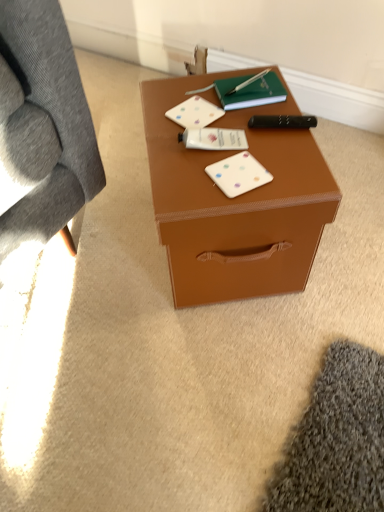
I want to click on free point in front of brown matte box at center, so click(x=223, y=381).